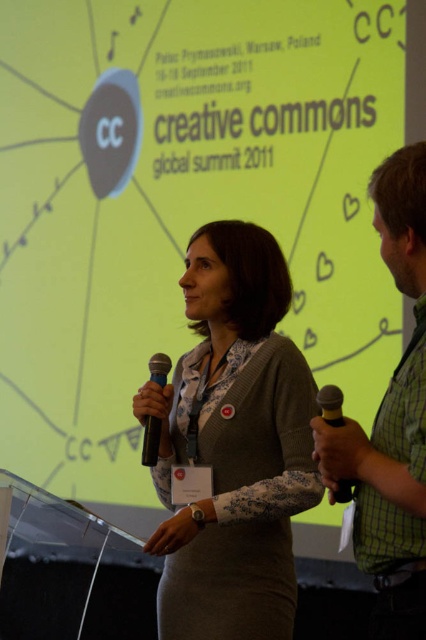
You are an attendee at the Creative Commons Global Summit 2011. You notice two points marked on the podium in front of the speaker. The first point is at coordinate (x=275, y=301) and the second at (x=347, y=435). Which point is closer to you as you face the podium?

Point (x=275, y=301) is closer to you because it is further to the viewer than point (x=347, y=435).

In the scene shown: You are attending the Creative Commons Global Summit 2011 and standing in front of the podium. There are two points marked on the screen behind the podium. The first point is at coordinate point (279,445) and the second point is at coordinate point (147,464). Which point is closer to you?

Point (147,464) is closer to you because it is nearer to the camera compared to point (279,445), which is further away.

You are attending the Creative Commons Global Summit 2011 and notice two presenters at the podium. The woman in the matte gray dress at center is speaking. Where is the person wearing the green checkered shirt at right in relation to her?

The green checkered shirt at right is behind the matte gray dress at center.